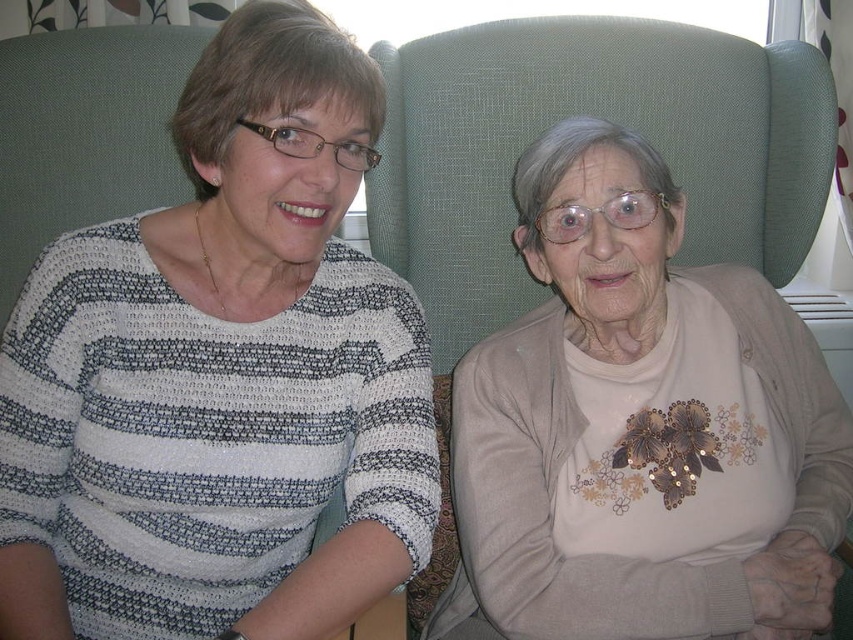
Which of these two, matte striped sweater at center or beige embroidered sweater at center, stands shorter?

Standing shorter between the two is beige embroidered sweater at center.

Who is lower down, matte striped sweater at center or beige embroidered sweater at center?

Positioned lower is beige embroidered sweater at center.

The height and width of the screenshot is (640, 853). What are the coordinates of `matte striped sweater at center` in the screenshot? It's located at (221, 376).